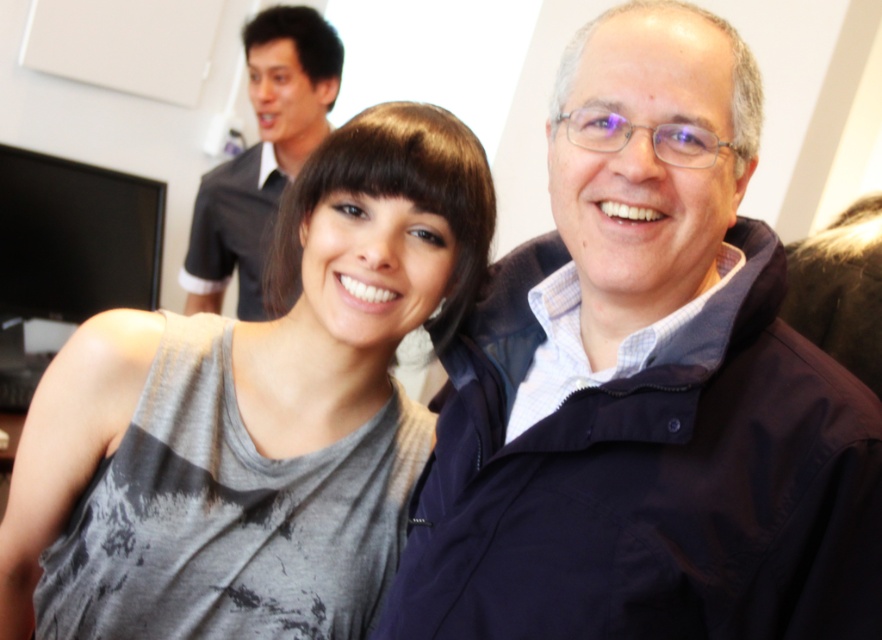
Question: Is navy blue jacket at center to the left of dark gray shirt at upper left from the viewer's perspective?

Choices:
 (A) no
 (B) yes

Answer: (A)

Question: Which point is closer to the camera?

Choices:
 (A) gray matte tank top at center
 (B) navy blue jacket at center
 (C) dark gray shirt at upper left

Answer: (B)

Question: From the image, what is the correct spatial relationship of navy blue jacket at center in relation to dark gray shirt at upper left?

Choices:
 (A) below
 (B) above

Answer: (A)

Question: Considering the real-world distances, which object is farthest from the gray matte tank top at center?

Choices:
 (A) navy blue jacket at center
 (B) dark gray shirt at upper left

Answer: (B)

Question: Which object appears closest to the camera in this image?

Choices:
 (A) dark gray shirt at upper left
 (B) navy blue jacket at center

Answer: (B)

Question: Does navy blue jacket at center appear over gray matte tank top at center?

Choices:
 (A) yes
 (B) no

Answer: (A)